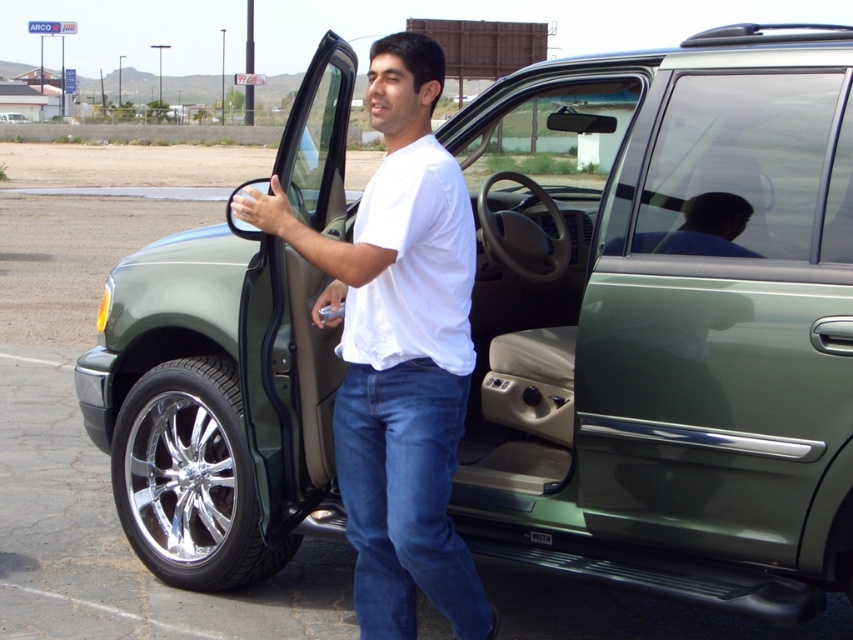
You are a delivery person who needs to hand a package to the man in the image. The package is too large to fit in your bag, so you must place it on the ground. Where should you place the package so that it is closest to both the satin green door at lower right and the white cotton shirt at center?

The package should be placed between the satin green door at lower right and the white cotton shirt at center since the satin green door at lower right is positioned on the right side of the white cotton shirt at center, making the midpoint between them the closest point to both objects.

You are a photographer trying to capture a photo of the white cotton shirt at center and the green metallic suv at center. Since you want both objects to appear the same size in the photo, which object should you move closer to the camera?

The white cotton shirt at center is smaller than the green metallic suv at center, so you should move the white cotton shirt at center closer to the camera to make it appear larger in the photo while keeping the SUV farther back.